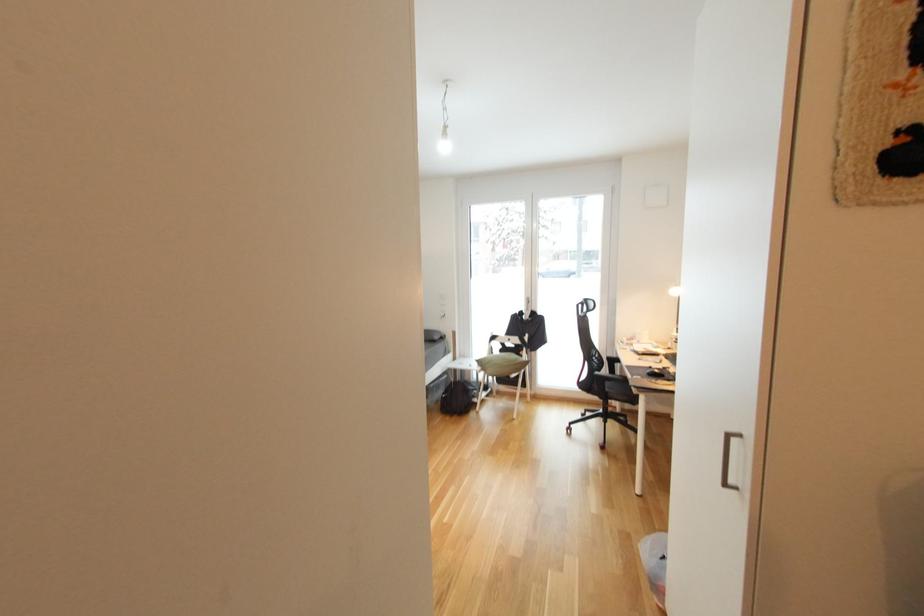
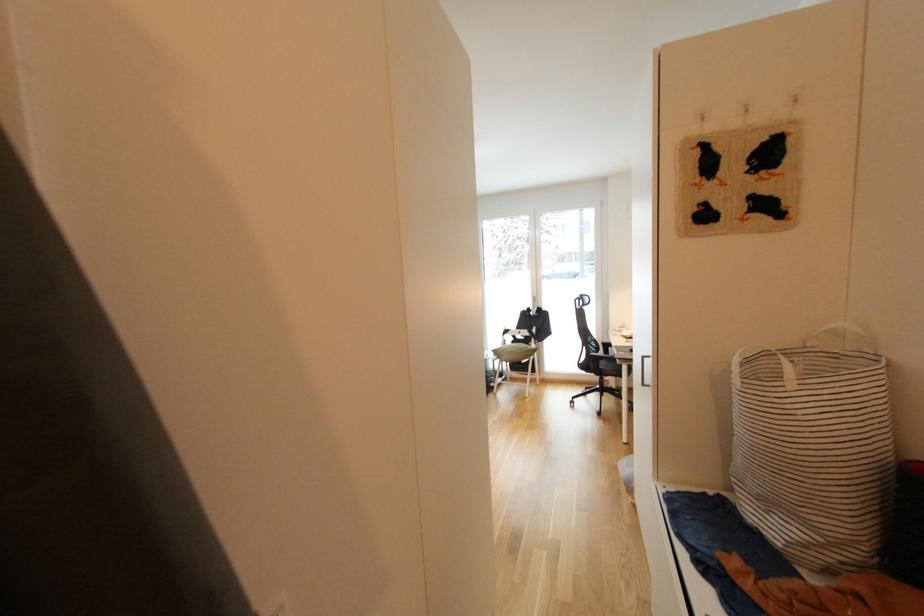
Question: What movement of the cameraman would produce the second image?

Choices:
 (A) Left
 (B) Right
 (C) Forward
 (D) Backward

Answer: (D)